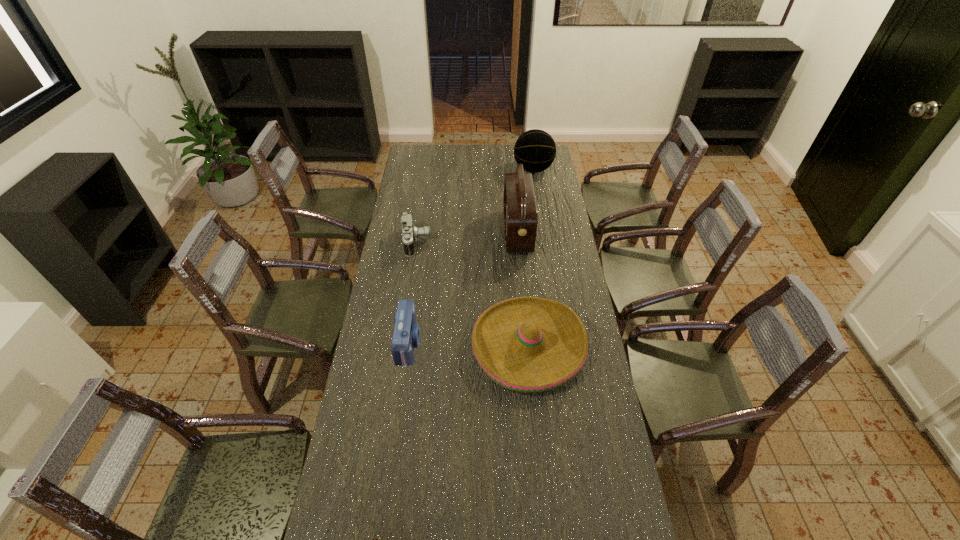
Locate an element on the screen. free spot located on the lens of the tallest camera is located at coordinates (484, 343).

The image size is (960, 540). In order to click on blank area located on the back of the sombrero in this screenshot , I will do `click(519, 247)`.

Find the location of a particular element. The height and width of the screenshot is (540, 960). free spot located at the lens of the farthest camera is located at coordinates (462, 242).

You are a GUI agent. You are given a task and a screenshot of the screen. Output one action in this format:
    pyautogui.click(x=<x>, y=<y>)
    Task: Click on the object that is at the far edge
    Image resolution: width=960 pixels, height=540 pixels.
    Given the screenshot: What is the action you would take?
    click(535, 149)

Locate an element on the screen. basketball located at the right edge is located at coordinates (535, 149).

Where is `sombrero that is at the right edge`? sombrero that is at the right edge is located at coordinates (526, 344).

Locate an element on the screen. object positioned at the far right corner is located at coordinates pos(535,149).

The width and height of the screenshot is (960, 540). Find the location of `vacant point at the far edge`. vacant point at the far edge is located at coordinates (483, 163).

The image size is (960, 540). What are the coordinates of `vacant space at the left edge` in the screenshot? It's located at (381, 281).

The width and height of the screenshot is (960, 540). Identify the location of vacant region at the right edge of the desktop. (570, 251).